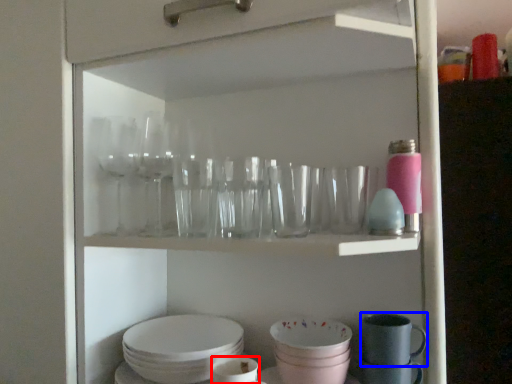
Question: Which object appears farthest to the camera in this image, tableware (highlighted by a red box) or tableware (highlighted by a blue box)?

Choices:
 (A) tableware
 (B) tableware

Answer: (B)